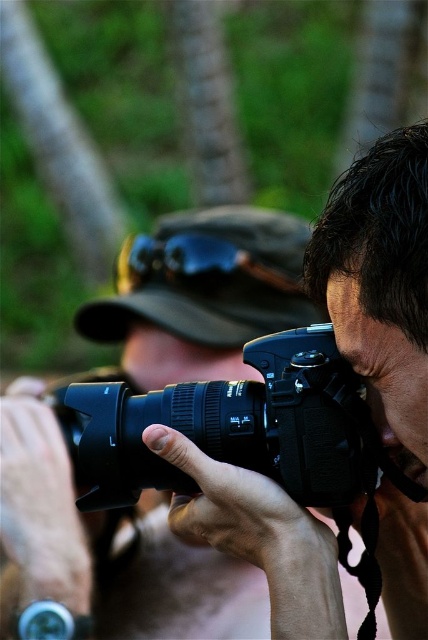
Which is in front, point (160, 339) or point (95, 419)?

Point (95, 419)

Which is behind, point (115, 528) or point (290, 346)?

Point (115, 528)

The height and width of the screenshot is (640, 428). I want to click on black matte camera at center, so click(107, 547).

Find the location of a particular element. black matte camera at center is located at coordinates (107, 547).